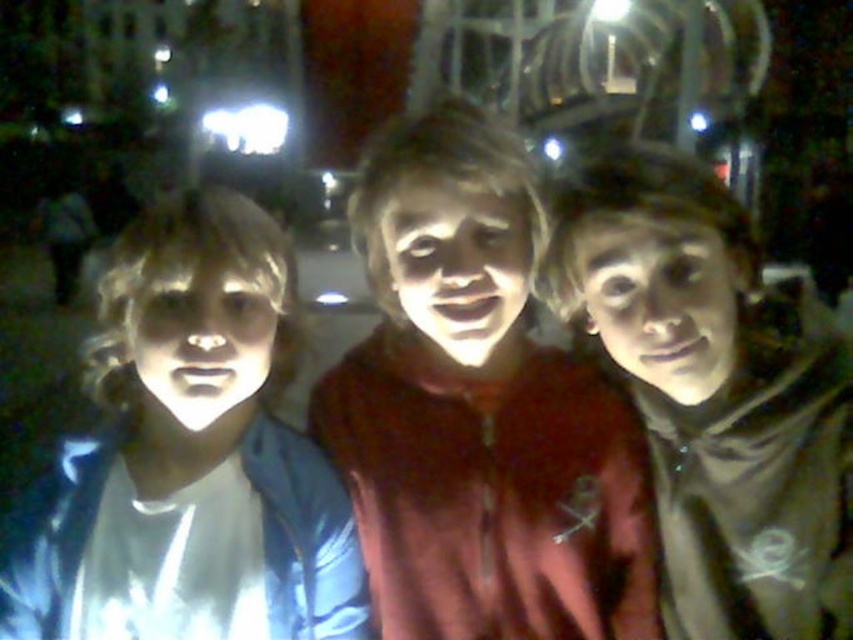
Can you confirm if matte red hoodie at center is positioned above matte blue jacket at left?

Indeed, matte red hoodie at center is positioned over matte blue jacket at left.

Who is more distant from viewer, (372, 442) or (213, 500)?

The point (372, 442) is more distant.

Identify the location of matte red hoodie at center. The image size is (853, 640). (479, 410).

Is point (587, 579) closer to viewer compared to point (780, 388)?

No.

From the picture: Is matte red hoodie at center bigger than matte black hoodie at center?

Indeed, matte red hoodie at center has a larger size compared to matte black hoodie at center.

The image size is (853, 640). What do you see at coordinates (479, 410) in the screenshot? I see `matte red hoodie at center` at bounding box center [479, 410].

This screenshot has height=640, width=853. In order to click on matte red hoodie at center in this screenshot , I will do pyautogui.click(x=479, y=410).

The image size is (853, 640). Describe the element at coordinates (190, 456) in the screenshot. I see `matte blue jacket at left` at that location.

Between matte blue jacket at left and matte black hoodie at center, which one is positioned lower?

matte blue jacket at left is lower down.

Does point (167, 394) come in front of point (738, 582)?

Yes, point (167, 394) is in front of point (738, 582).

Locate an element on the screen. matte blue jacket at left is located at coordinates 190,456.